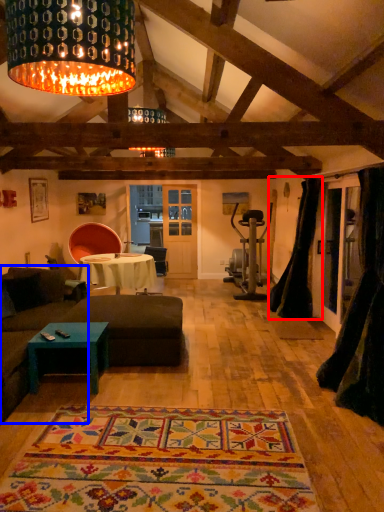
Question: Which of the following is the closest to the observer, curtain (highlighted by a red box) or couch (highlighted by a blue box)?

Choices:
 (A) curtain
 (B) couch

Answer: (B)